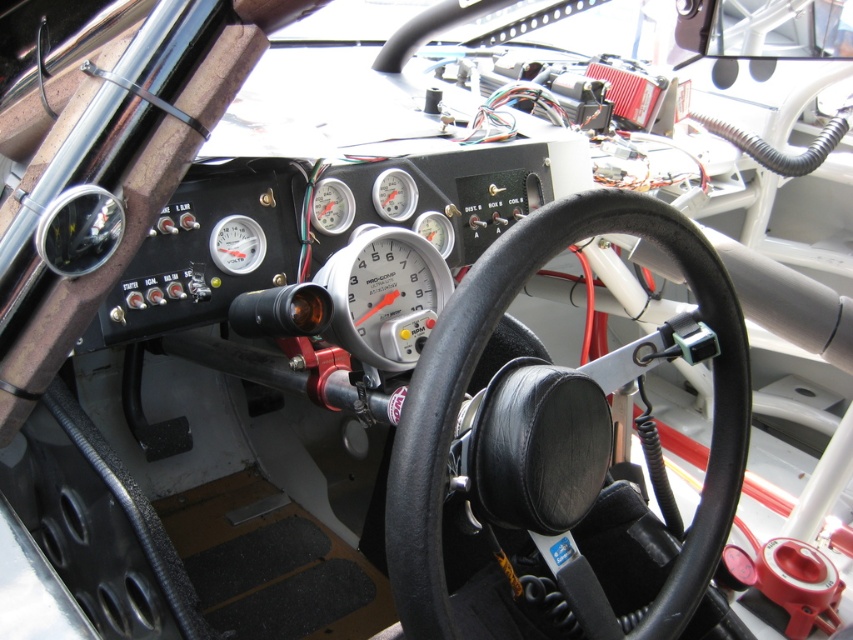
Between silver metallic speedometer at center and white plastic speedometer at center, which one is positioned higher?

Positioned higher is white plastic speedometer at center.

This screenshot has height=640, width=853. What do you see at coordinates (384, 296) in the screenshot? I see `silver metallic speedometer at center` at bounding box center [384, 296].

The width and height of the screenshot is (853, 640). I want to click on silver metallic speedometer at center, so click(x=384, y=296).

Who is more forward, (419, 413) or (230, 246)?

Point (419, 413) is more forward.

Find the location of `black leather steering wheel at center`. black leather steering wheel at center is located at coordinates (469, 376).

Based on the photo, is black leather steering wheel at center to the left of silver metallic speedometer at center from the viewer's perspective?

No, black leather steering wheel at center is not to the left of silver metallic speedometer at center.

Is black leather steering wheel at center above silver metallic speedometer at center?

Actually, black leather steering wheel at center is below silver metallic speedometer at center.

Identify the location of black leather steering wheel at center. (469, 376).